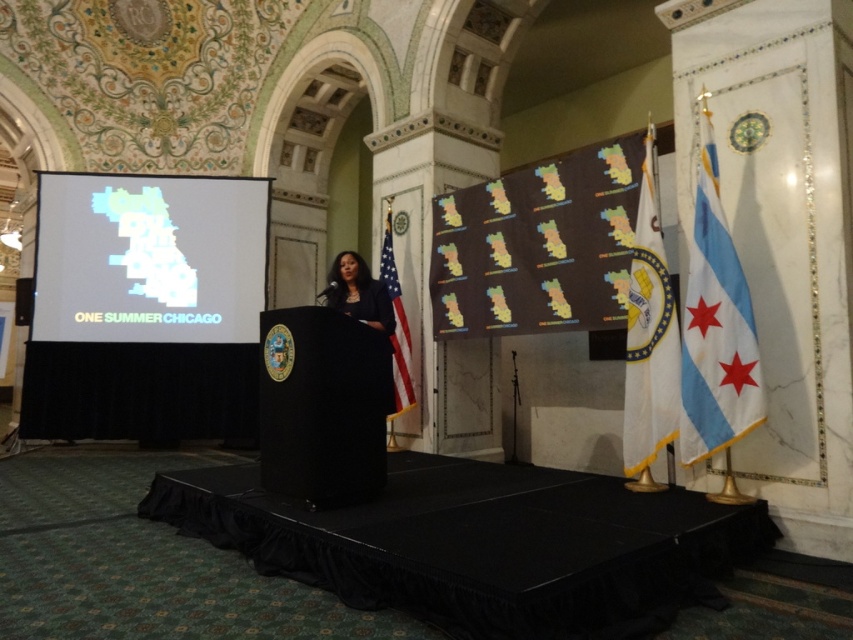
Can you confirm if blue fabric flag at right is bigger than black fabric at center?

Correct, blue fabric flag at right is larger in size than black fabric at center.

Looking at this image, is blue fabric flag at right shorter than black fabric at center?

Incorrect, blue fabric flag at right's height does not fall short of black fabric at center's.

The image size is (853, 640). I want to click on blue fabric flag at right, so click(715, 326).

Can you confirm if translucent plastic map at left is positioned above white fabric flag at right?

Yes.

Is translucent plastic map at left bigger than white fabric flag at right?

Yes.

Which is behind, point (91, 208) or point (651, 266)?

Point (91, 208)

Locate an element on the screen. This screenshot has height=640, width=853. translucent plastic map at left is located at coordinates pos(149,257).

Who is more forward, (x=694, y=243) or (x=392, y=342)?

Point (x=694, y=243) is in front.

Which is below, blue fabric flag at right or american flag at center?

american flag at center is lower down.

Is point (726, 346) positioned behind point (384, 253)?

No, (726, 346) is in front of (384, 253).

You are a GUI agent. You are given a task and a screenshot of the screen. Output one action in this format:
    pyautogui.click(x=<x>, y=<y>)
    Task: Click on the blue fabric flag at right
    The height and width of the screenshot is (640, 853).
    Given the screenshot: What is the action you would take?
    pyautogui.click(x=715, y=326)